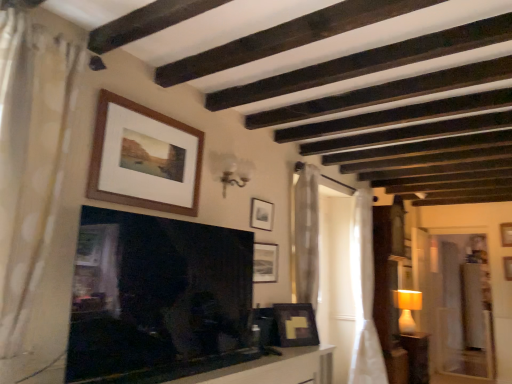
Find the location of a particular element. Image resolution: width=512 pixels, height=384 pixels. blank space situated above white fabric lampshade at right (from a real-world perspective) is located at coordinates (407, 291).